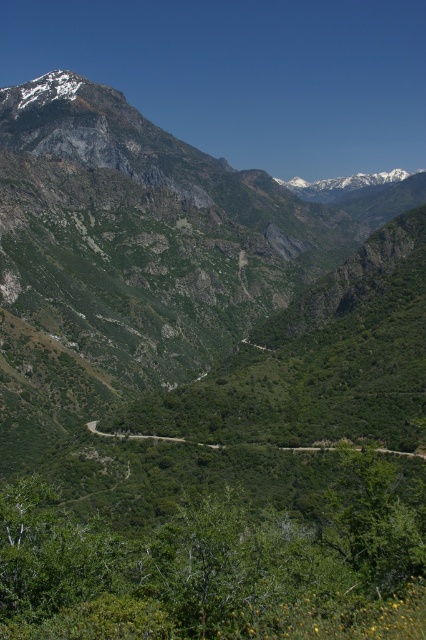
Question: Can you confirm if green rocky mountain range at upper left is positioned above green leafy road at center?

Choices:
 (A) yes
 (B) no

Answer: (A)

Question: Can you confirm if green rocky mountain range at upper left is positioned to the left of green leafy road at center?

Choices:
 (A) no
 (B) yes

Answer: (A)

Question: Which of the following is the farthest from the observer?

Choices:
 (A) green rocky mountain range at upper left
 (B) green leafy road at center

Answer: (B)

Question: In this image, where is green rocky mountain range at upper left located relative to green leafy road at center?

Choices:
 (A) above
 (B) below

Answer: (A)

Question: Which of the following is the farthest from the observer?

Choices:
 (A) green leafy road at center
 (B) green rocky mountain range at upper left

Answer: (A)